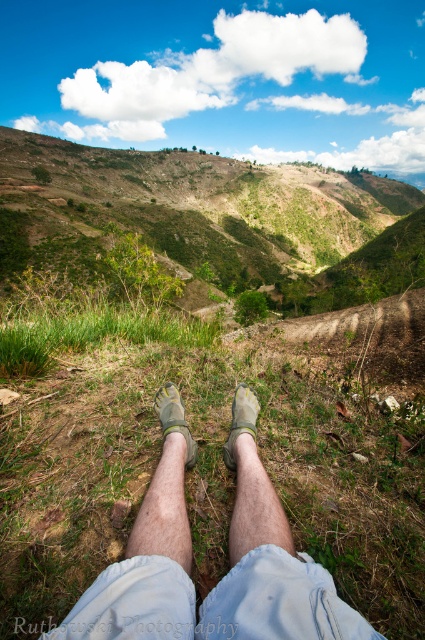
In the scene shown: Who is lower down, light gray fabric legs at center or green grass at lower center?

light gray fabric legs at center is lower down.

Does point (263, 614) lie behind point (93, 326)?

No.

Image resolution: width=425 pixels, height=640 pixels. Find the location of `light gray fabric legs at center`. light gray fabric legs at center is located at coordinates (221, 579).

Which is below, light gray fabric legs at center or light gray fabric sock at center?

light gray fabric legs at center

Who is shorter, light gray fabric legs at center or light gray fabric sock at center?

light gray fabric legs at center

Is point (232, 632) farther from viewer compared to point (238, 417)?

No, (232, 632) is closer to viewer.

Locate an element on the screen. Image resolution: width=425 pixels, height=640 pixels. light gray fabric legs at center is located at coordinates (221, 579).

Is the position of green grassy hillside at upper center less distant than that of green grass at lower center?

No, green grassy hillside at upper center is behind green grass at lower center.

Who is more distant from viewer, (309, 209) or (20, 337)?

Point (309, 209)

Is point (176, 163) farther from viewer compared to point (31, 314)?

Yes, point (176, 163) is behind point (31, 314).

I want to click on green grassy hillside at upper center, so click(232, 216).